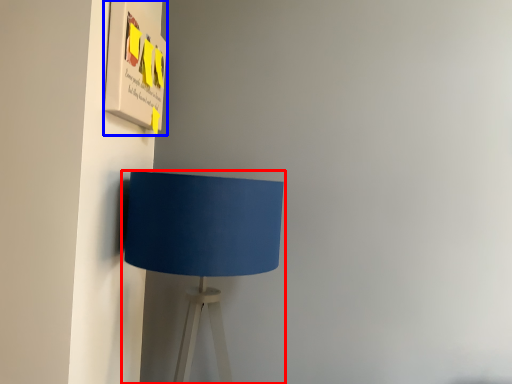
Question: Which point is further to the camera, lamp (highlighted by a red box) or poster (highlighted by a blue box)?

Choices:
 (A) lamp
 (B) poster

Answer: (B)